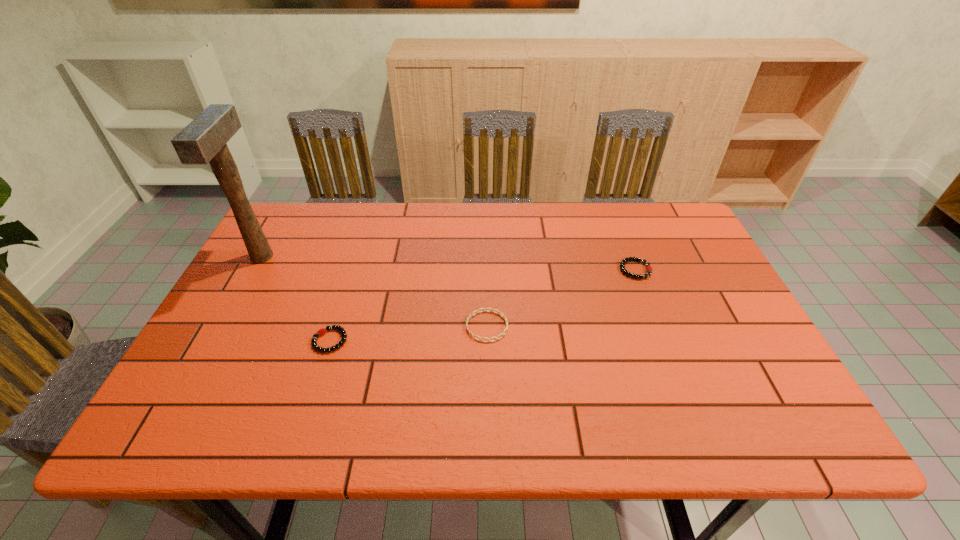
Point out which object is positioned as the third nearest to the third object from left to right. Please provide its 2D coordinates. Your answer should be formatted as a tuple, i.e. [(x, y)], where the tuple contains the x and y coordinates of a point satisfying the conditions above.

[(203, 140)]

I want to click on bracelet that is the second closest one to the rightmost object, so click(x=322, y=331).

Where is `bracelet that stands as the second closest to the mallet`? This screenshot has width=960, height=540. bracelet that stands as the second closest to the mallet is located at coordinates (477, 311).

In order to click on free location that satisfies the following two spatial constraints: 1. on the surface of the second object from right to left showing star-shaped elements; 2. on the front side of the third object from right to left in this screenshot , I will do `click(488, 341)`.

This screenshot has height=540, width=960. In order to click on vacant space that satisfies the following two spatial constraints: 1. on the surface of the second bracelet from right to left showing star-shaped elements; 2. on the front side of the second object from left to right in this screenshot , I will do `click(488, 341)`.